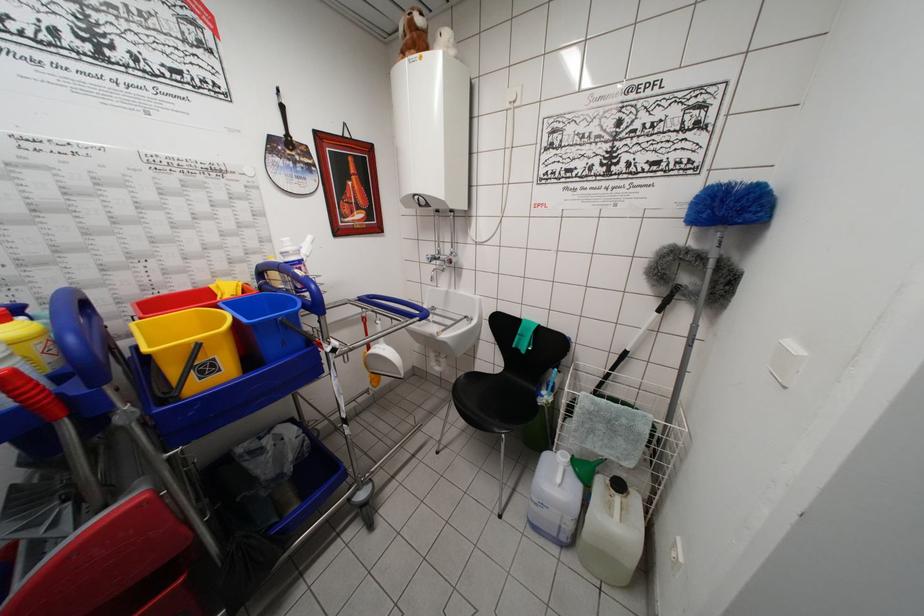
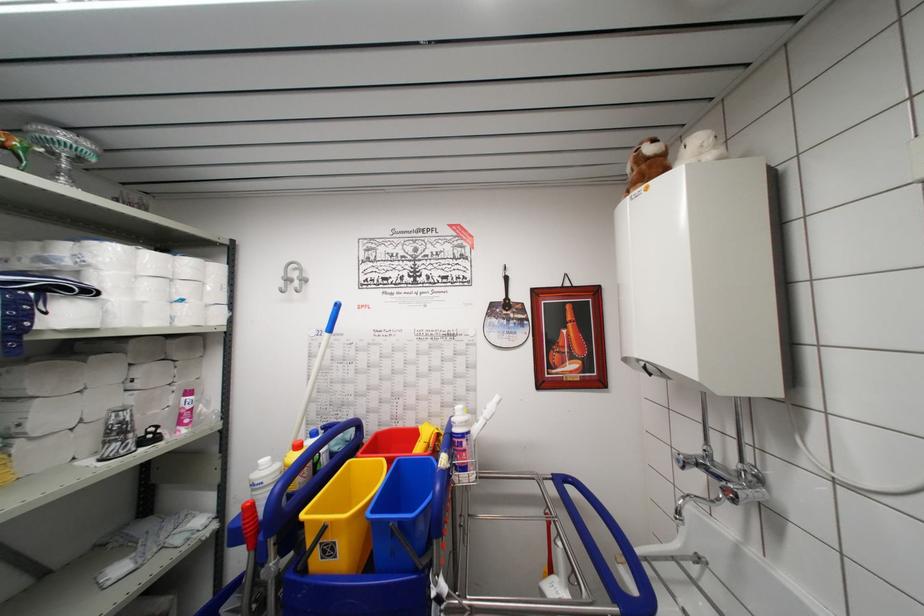
Question: Based on the continuous images, in which direction is the camera rotating? Reply with the corresponding letter.

Choices:
 (A) Left
 (B) Right
 (C) Up
 (D) Down

Answer: (A)